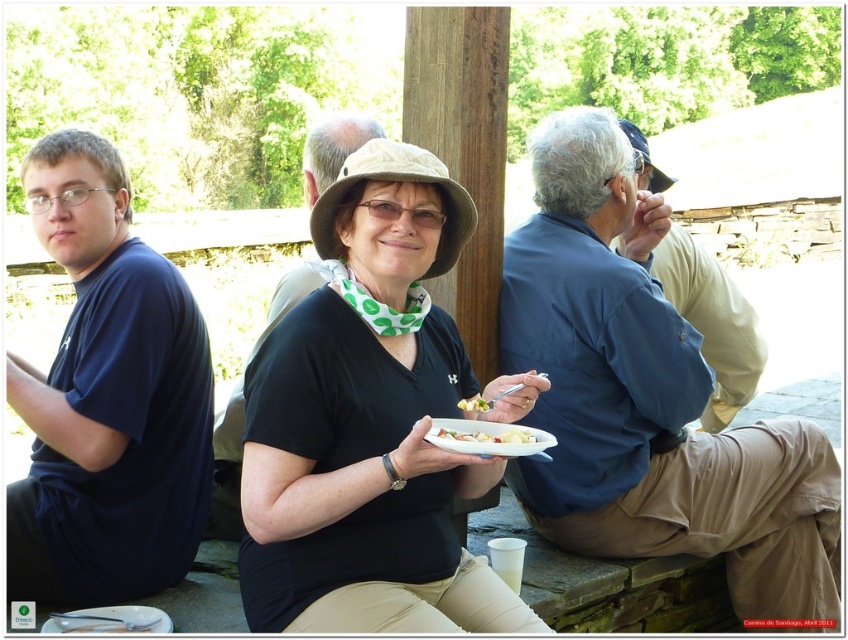
Question: Among these objects, which one is nearest to the camera?

Choices:
 (A) blue cotton shirt at center
 (B) white matte plate at center

Answer: (B)

Question: Is the position of dark blue t-shirt at left more distant than that of blue cotton shirt at right?

Choices:
 (A) no
 (B) yes

Answer: (B)

Question: Which of the following is the farthest from the observer?

Choices:
 (A) black shirt at center
 (B) black matte shirt at center

Answer: (A)

Question: Does black matte shirt at center lie behind dark blue t-shirt at left?

Choices:
 (A) yes
 (B) no

Answer: (B)

Question: Which of these objects is positioned farthest from the white creamy pasta at center?

Choices:
 (A) blue cotton shirt at center
 (B) yellow matte food at center

Answer: (A)

Question: Does black matte shirt at center have a larger size compared to white creamy pasta at center?

Choices:
 (A) yes
 (B) no

Answer: (A)